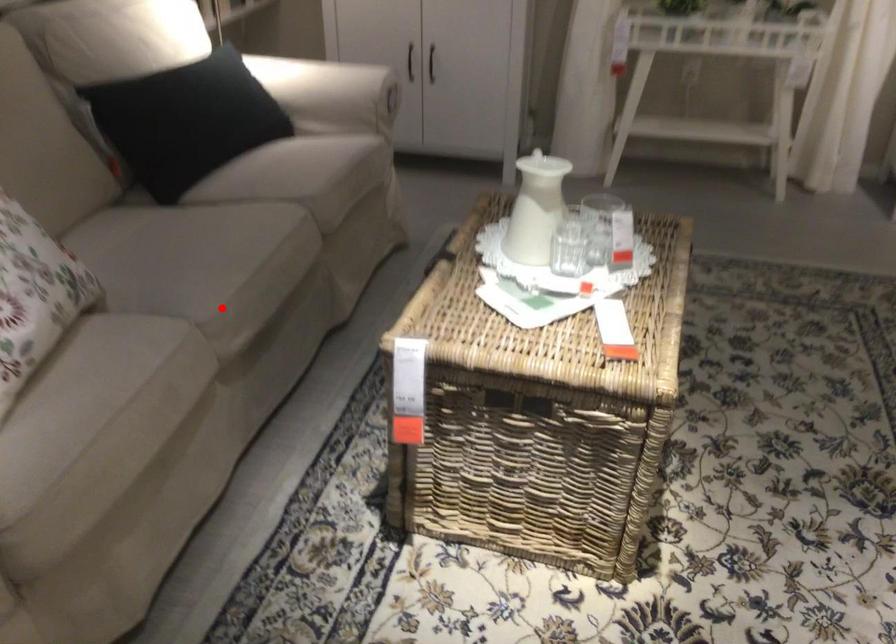
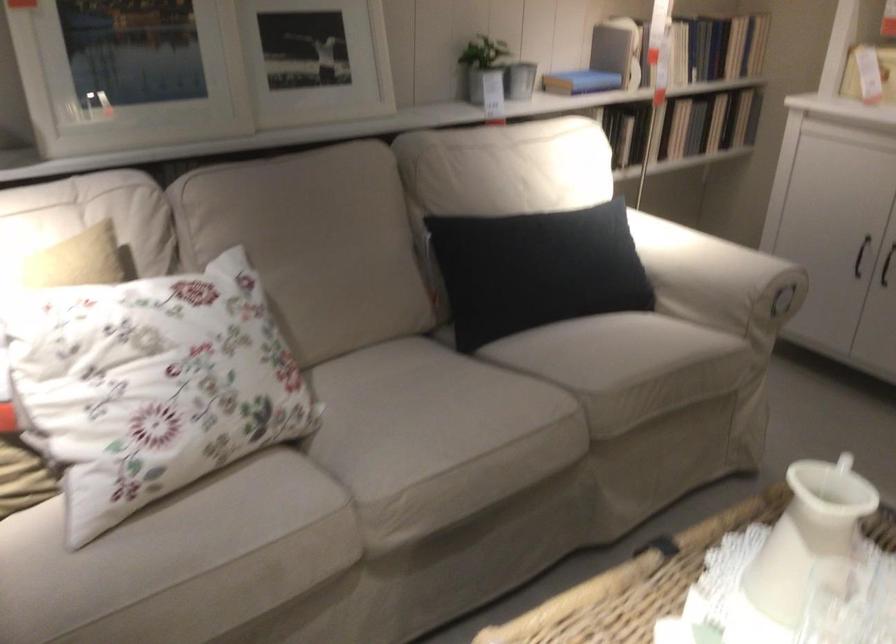
Question: A red point is marked in image1. In image2, is the corresponding 3D point closer to the camera or farther? Reply with the corresponding letter.

Choices:
 (A) The corresponding 3D point is closer.
 (B) The corresponding 3D point is farther.

Answer: (A)